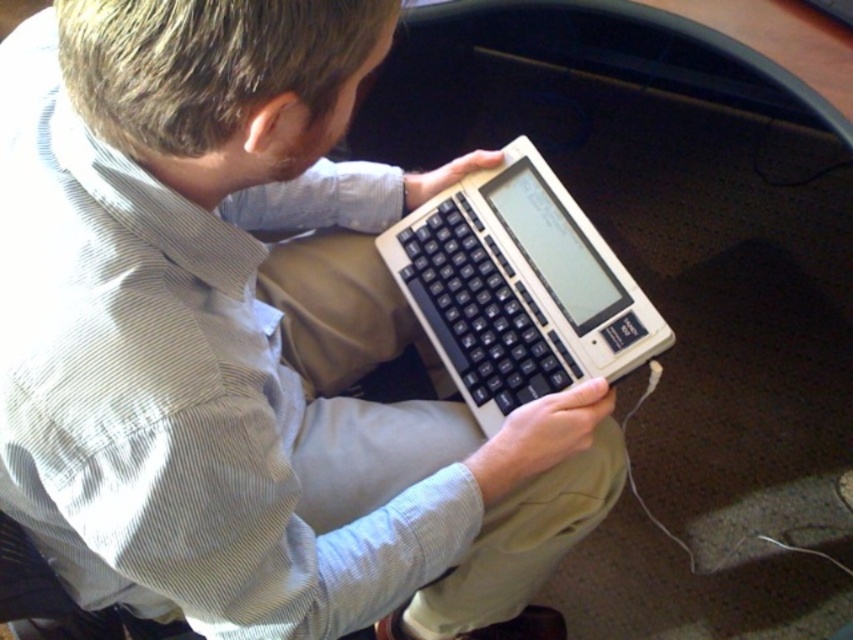
You are trying to decide which device to use between the matte black laptop at center and the white plastic computer at center. Considering their sizes, which one might be more suitable for carrying around?

The white plastic computer at center is much shorter than the matte black laptop at center, so it might be easier to carry around.

You are organizing a tech exhibition and need to arrange two computers on a display table. The matte black laptop at center and the white plastic computer at center are both to be placed. According to the image, which computer should be placed to the left side of the other?

The matte black laptop at center is positioned on the left side of white plastic computer at center, so the matte black laptop at center should be placed to the left of the white plastic computer at center.